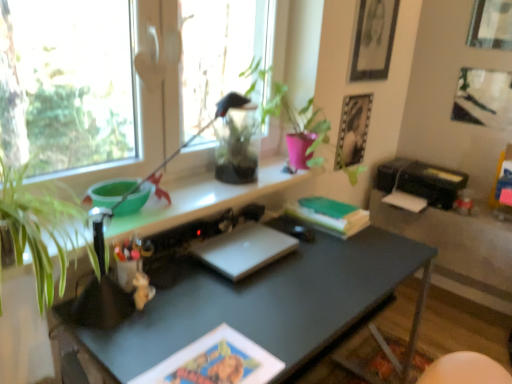
Question: Considering the relative positions of matte black desk at center and metallic silver picture frame at upper right, arranged as the 2th picture frame when viewed from the right, in the image provided, is matte black desk at center behind metallic silver picture frame at upper right, arranged as the 2th picture frame when viewed from the right,?

Choices:
 (A) no
 (B) yes

Answer: (A)

Question: Can you confirm if matte black desk at center is shorter than metallic silver picture frame at upper right, arranged as the 2th picture frame when viewed from the right?

Choices:
 (A) yes
 (B) no

Answer: (B)

Question: Can you confirm if matte black desk at center is positioned to the right of metallic silver picture frame at upper right, arranged as the 2th picture frame when viewed from the right?

Choices:
 (A) yes
 (B) no

Answer: (B)

Question: Is the surface of matte black desk at center in direct contact with metallic silver picture frame at upper right, the third picture frame when ordered from left to right?

Choices:
 (A) no
 (B) yes

Answer: (A)

Question: From a real-world perspective, is matte black desk at center on top of metallic silver picture frame at upper right, the third picture frame when ordered from left to right?

Choices:
 (A) no
 (B) yes

Answer: (A)

Question: Can you confirm if matte black desk at center is taller than metallic silver picture frame at upper right, the third picture frame when ordered from left to right?

Choices:
 (A) no
 (B) yes

Answer: (B)

Question: Is metallic silver photo frame at upper right, positioned as the first picture frame in left-to-right order, surrounded by transparent glass window at upper left?

Choices:
 (A) yes
 (B) no

Answer: (B)

Question: From a real-world perspective, is transparent glass window at upper left under metallic silver photo frame at upper right, positioned as the first picture frame in left-to-right order?

Choices:
 (A) yes
 (B) no

Answer: (B)

Question: Does transparent glass window at upper left appear on the left side of metallic silver photo frame at upper right, positioned as the first picture frame in left-to-right order?

Choices:
 (A) no
 (B) yes

Answer: (B)

Question: Is transparent glass window at upper left touching metallic silver photo frame at upper right, placed as the 4th picture frame when sorted from right to left?

Choices:
 (A) no
 (B) yes

Answer: (A)

Question: Does transparent glass window at upper left have a greater height compared to metallic silver photo frame at upper right, placed as the 4th picture frame when sorted from right to left?

Choices:
 (A) no
 (B) yes

Answer: (B)

Question: Is transparent glass window at upper left thinner than metallic silver photo frame at upper right, positioned as the first picture frame in left-to-right order?

Choices:
 (A) no
 (B) yes

Answer: (A)

Question: Is metallic silver photo frame at upper right, positioned as the first picture frame in left-to-right order, far away from matte black picture frame at upper right, acting as the 2th picture frame starting from the left?

Choices:
 (A) yes
 (B) no

Answer: (B)